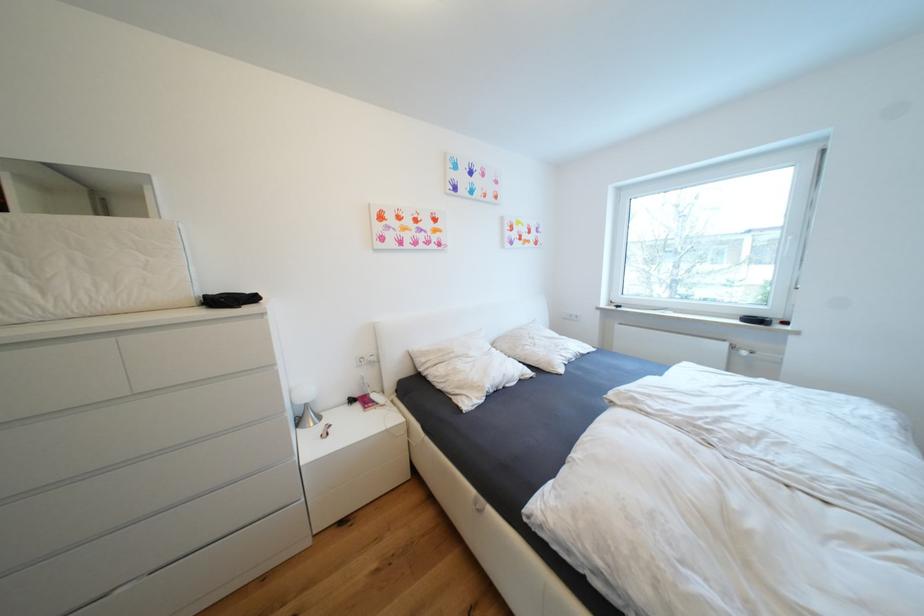
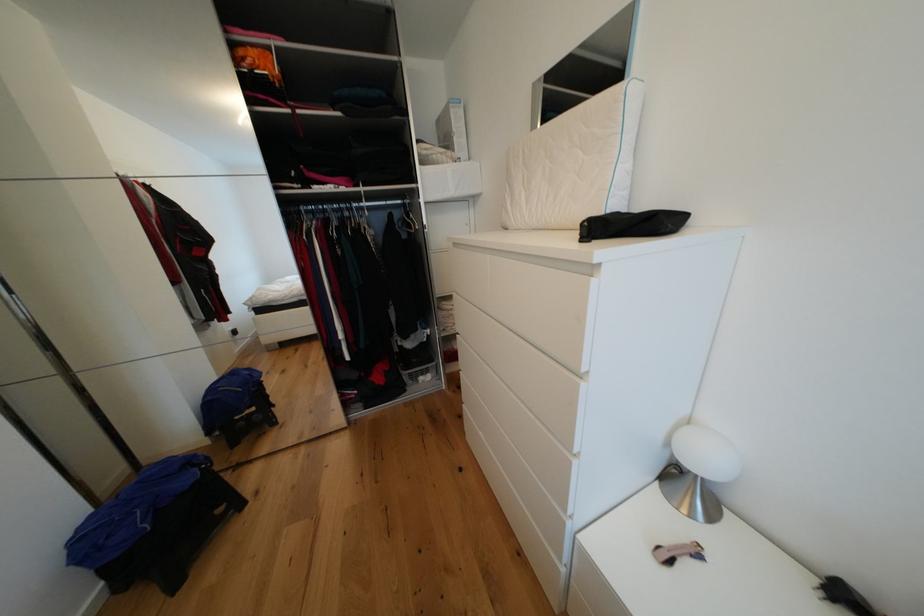
Based on the continuous images, in which direction is the camera rotating?

The rotation direction of the camera is left-down.